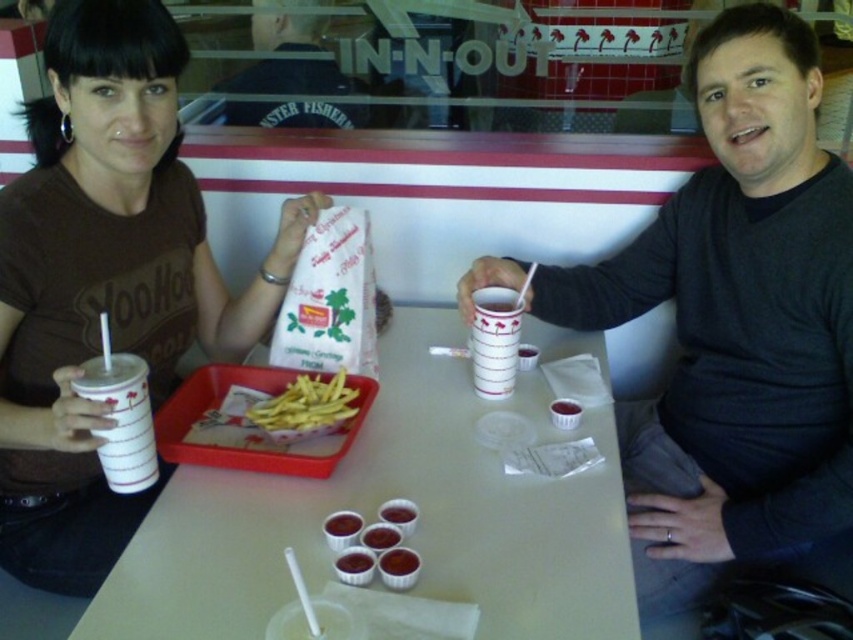
Question: Can you confirm if white paper cup at left is smaller than smooth plastic cup at center?

Choices:
 (A) no
 (B) yes

Answer: (A)

Question: Which object appears farthest from the camera in this image?

Choices:
 (A) matte black shirt at upper left
 (B) matte black shirt at center
 (C) smooth plastic cup at center

Answer: (B)

Question: Which object is closer to the camera taking this photo?

Choices:
 (A) black cotton shirt at center
 (B) matte black shirt at upper left
 (C) golden crispy french fries at center
 (D) white paper tray at center

Answer: (D)

Question: Is the position of white paper tray at center more distant than that of white paper cup at left?

Choices:
 (A) yes
 (B) no

Answer: (B)

Question: Does white paper cup at center appear on the left side of smooth plastic cup at center?

Choices:
 (A) yes
 (B) no

Answer: (B)

Question: Among these points, which one is farthest from the camera?

Choices:
 (A) (49, 168)
 (B) (386, 477)
 (C) (392, 561)
 (D) (262, 36)

Answer: (D)